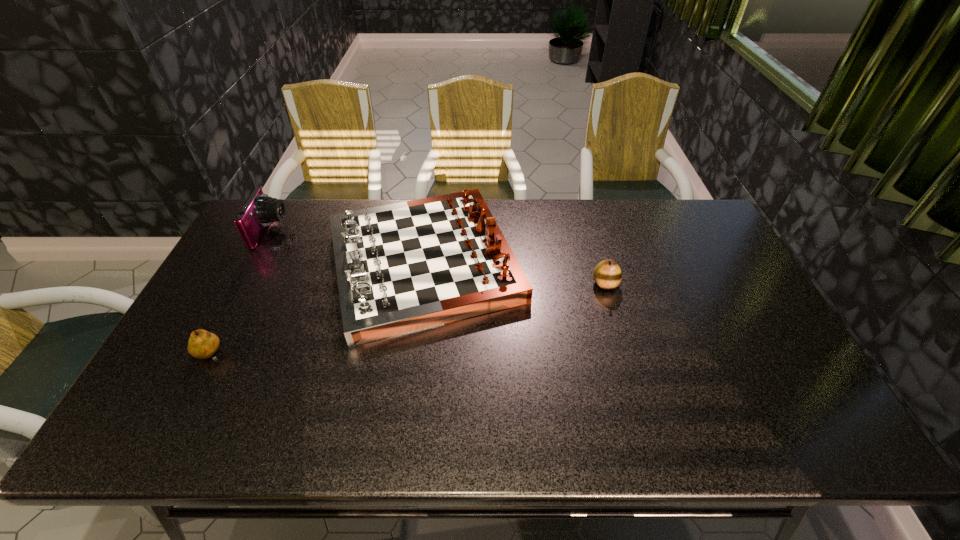
Where is `the second object from right to left`? This screenshot has height=540, width=960. the second object from right to left is located at coordinates (403, 267).

This screenshot has height=540, width=960. Find the location of `gameboard`. gameboard is located at coordinates (403, 267).

Locate an element on the screen. Image resolution: width=960 pixels, height=540 pixels. camera is located at coordinates (260, 210).

Find the location of a particular element. This screenshot has height=540, width=960. the rightmost object is located at coordinates (607, 274).

The image size is (960, 540). In order to click on the farther pear in this screenshot , I will do `click(607, 274)`.

Image resolution: width=960 pixels, height=540 pixels. What are the coordinates of `the shortest object` in the screenshot? It's located at (x=202, y=344).

At what (x,y) coordinates should I click in order to perform the action: click on the shorter pear. Please return your answer as a coordinate pair (x, y). Image resolution: width=960 pixels, height=540 pixels. Looking at the image, I should click on (202, 344).

You are a GUI agent. You are given a task and a screenshot of the screen. Output one action in this format:
    pyautogui.click(x=<x>, y=<y>)
    Task: Click on the free space located on the right of the second object from right to left
    
    Given the screenshot: What is the action you would take?
    pyautogui.click(x=597, y=263)

I want to click on vacant area situated on the front-facing side of the camera, so click(397, 232).

Image resolution: width=960 pixels, height=540 pixels. I want to click on vacant space located on the back of the farther pear, so click(x=585, y=211).